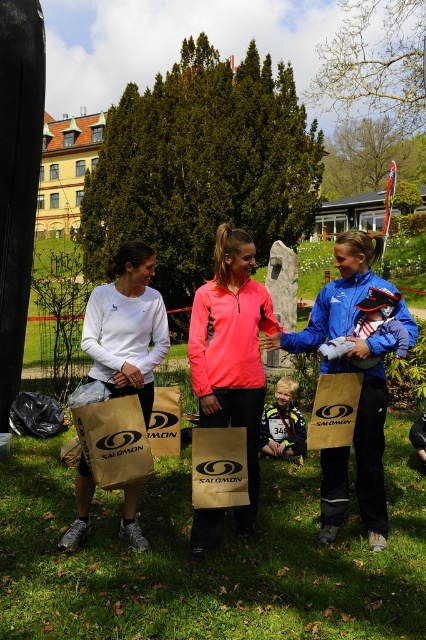
Which of these two, green grass at center or white matte bag at left, stands shorter?

green grass at center

Is green grass at center to the left of white matte bag at left from the viewer's perspective?

No, green grass at center is not to the left of white matte bag at left.

Who is more distant from viewer, (350,552) or (75,541)?

Point (350,552)

Identify the location of green grass at center. The width and height of the screenshot is (426, 640). click(209, 556).

Image resolution: width=426 pixels, height=640 pixels. I want to click on neon pink zip-up jacket at center, so click(x=232, y=352).

Where is `neon pink zip-up jacket at center`? The width and height of the screenshot is (426, 640). neon pink zip-up jacket at center is located at coordinates (232, 352).

Looking at this image, is neon pink zip-up jacket at center wider than brown paper bag at center?

Indeed, neon pink zip-up jacket at center has a greater width compared to brown paper bag at center.

Between neon pink zip-up jacket at center and brown paper bag at center, which one is positioned higher?

neon pink zip-up jacket at center is above.

Who is more distant from viewer, (227, 403) or (141, 433)?

The point (227, 403) is more distant.

Locate an element on the screen. neon pink zip-up jacket at center is located at coordinates (232, 352).